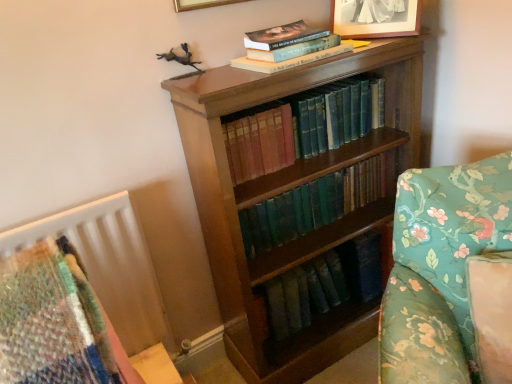
Image resolution: width=512 pixels, height=384 pixels. In order to click on floral fabric sofa at right in this screenshot , I will do `click(450, 277)`.

Describe the element at coordinates (289, 60) in the screenshot. I see `hardcover book at upper center, which is the first book in top-to-bottom order` at that location.

What do you see at coordinates (287, 190) in the screenshot? The width and height of the screenshot is (512, 384). I see `wooden bookcase at center` at bounding box center [287, 190].

What do you see at coordinates (375, 18) in the screenshot?
I see `matte silver picture frame at upper center` at bounding box center [375, 18].

This screenshot has width=512, height=384. Identify the location of green leather book at center, which is the 2th book from top to bottom. (301, 126).

Find the location of a particular element. This screenshot has height=384, width=512. floral fabric sofa at right is located at coordinates (450, 277).

Can you confirm if wooden bookcase at center is smaller than hardcover book at upper center, positioned as the third book in bottom-to-top order?

No, wooden bookcase at center is not smaller than hardcover book at upper center, positioned as the third book in bottom-to-top order.

Does wooden bookcase at center touch hardcover book at upper center, which is the first book in top-to-bottom order?

There is a gap between wooden bookcase at center and hardcover book at upper center, which is the first book in top-to-bottom order.

Which of these two, wooden bookcase at center or hardcover book at upper center, which is the first book in top-to-bottom order, is thinner?

With smaller width is hardcover book at upper center, which is the first book in top-to-bottom order.

From the picture: Which is closer, (377, 34) or (291, 59)?

Point (377, 34).

Find the location of `the 1st book below the matte silver picture frame at upper center (from a real-world perspective)`. the 1st book below the matte silver picture frame at upper center (from a real-world perspective) is located at coordinates coord(289,60).

Considering the relative sizes of matte silver picture frame at upper center and hardcover book at upper center, positioned as the third book in bottom-to-top order, in the image provided, is matte silver picture frame at upper center bigger than hardcover book at upper center, positioned as the third book in bottom-to-top order,?

Yes.

From a real-world perspective, between matte silver picture frame at upper center and hardcover book at upper center, which is the first book in top-to-bottom order, who is vertically lower?

From a 3D spatial view, hardcover book at upper center, which is the first book in top-to-bottom order, is below.

Does matte silver picture frame at upper center have a greater width compared to floral fabric sofa at right?

No, matte silver picture frame at upper center is not wider than floral fabric sofa at right.

Is matte silver picture frame at upper center turned away from floral fabric sofa at right?

No, matte silver picture frame at upper center is not facing away from floral fabric sofa at right.

Considering the points (349, 36) and (492, 317), which point is behind, point (349, 36) or point (492, 317)?

The point (349, 36) is more distant.

From a real-world perspective, is green leather book at center, arranged as the 1th book when ordered from the bottom, physically below hardcover book at upper center, positioned as the third book in bottom-to-top order?

Correct, in the physical world, green leather book at center, arranged as the 1th book when ordered from the bottom, is lower than hardcover book at upper center, positioned as the third book in bottom-to-top order.

Considering the positions of objects green leather book at center, arranged as the 3th book when viewed from the top, and hardcover book at upper center, positioned as the third book in bottom-to-top order, in the image provided, who is behind, green leather book at center, arranged as the 3th book when viewed from the top, or hardcover book at upper center, positioned as the third book in bottom-to-top order,?

Positioned behind is green leather book at center, arranged as the 3th book when viewed from the top.

Is green leather book at center, arranged as the 1th book when ordered from the bottom, facing towards hardcover book at upper center, positioned as the third book in bottom-to-top order?

No, green leather book at center, arranged as the 1th book when ordered from the bottom, is not oriented towards hardcover book at upper center, positioned as the third book in bottom-to-top order.

Would you say green leather book at center, arranged as the 1th book when ordered from the bottom, contains hardcover book at upper center, positioned as the third book in bottom-to-top order?

Definitely not — hardcover book at upper center, positioned as the third book in bottom-to-top order, is not inside green leather book at center, arranged as the 1th book when ordered from the bottom.

Between hardcover book at upper center, which is the first book in top-to-bottom order, and wooden bookcase at center, which one appears on the right side from the viewer's perspective?

Positioned to the right is wooden bookcase at center.

In terms of size, does hardcover book at upper center, positioned as the third book in bottom-to-top order, appear bigger or smaller than wooden bookcase at center?

In the image, hardcover book at upper center, positioned as the third book in bottom-to-top order, appears to be smaller than wooden bookcase at center.

Is hardcover book at upper center, which is the first book in top-to-bottom order, beside wooden bookcase at center?

No, hardcover book at upper center, which is the first book in top-to-bottom order, is not with wooden bookcase at center.

Is green leather book at center, arranged as the 3th book when viewed from the top, wider than green leather book at center, placed as the second book when sorted from bottom to top?

Indeed, green leather book at center, arranged as the 3th book when viewed from the top, has a greater width compared to green leather book at center, placed as the second book when sorted from bottom to top.

Is green leather book at center, arranged as the 1th book when ordered from the bottom, oriented towards green leather book at center, which is the 2th book from top to bottom?

No, green leather book at center, arranged as the 1th book when ordered from the bottom, is not turned towards green leather book at center, which is the 2th book from top to bottom.

Which of these two, green leather book at center, arranged as the 3th book when viewed from the top, or green leather book at center, placed as the second book when sorted from bottom to top, stands shorter?

Standing shorter between the two is green leather book at center, arranged as the 3th book when viewed from the top.

Is green leather book at center, arranged as the 3th book when viewed from the top, at the left side of floral fabric sofa at right?

Yes.

From the image's perspective, which object appears higher, green leather book at center, arranged as the 1th book when ordered from the bottom, or floral fabric sofa at right?

green leather book at center, arranged as the 1th book when ordered from the bottom.

Is green leather book at center, arranged as the 1th book when ordered from the bottom, inside the boundaries of floral fabric sofa at right, or outside?

green leather book at center, arranged as the 1th book when ordered from the bottom, is spatially situated outside floral fabric sofa at right.

Is the depth of green leather book at center, arranged as the 3th book when viewed from the top, less than that of floral fabric sofa at right?

No, the depth of green leather book at center, arranged as the 3th book when viewed from the top, is greater than that of floral fabric sofa at right.

Which book is the 1st one when counting from the back of the wooden bookcase at center? Please provide its 2D coordinates.

[(289, 60)]

Where is `picture frame lying on the right of hardcover book at upper center, positioned as the third book in bottom-to-top order`? This screenshot has height=384, width=512. picture frame lying on the right of hardcover book at upper center, positioned as the third book in bottom-to-top order is located at coordinates (375, 18).

Which object lies nearer to the anchor point floral fabric sofa at right, hardcover book at upper center, positioned as the third book in bottom-to-top order, or green leather book at center, which is the 2th book from top to bottom?

Based on the image, green leather book at center, which is the 2th book from top to bottom, appears to be nearer to floral fabric sofa at right.

Estimate the real-world distances between objects in this image. Which object is further from matte silver picture frame at upper center, green leather book at center, which is the 2th book from top to bottom, or wooden bookcase at center?

Among the two, wooden bookcase at center is located further to matte silver picture frame at upper center.

From the image, which object appears to be farther from wooden bookcase at center, green leather book at center, placed as the second book when sorted from bottom to top, or floral fabric sofa at right?

Based on the image, floral fabric sofa at right appears to be further to wooden bookcase at center.

Based on their spatial positions, is wooden bookcase at center or hardcover book at upper center, positioned as the third book in bottom-to-top order, further from floral fabric sofa at right?

Among the two, hardcover book at upper center, positioned as the third book in bottom-to-top order, is located further to floral fabric sofa at right.

When comparing their distances from green leather book at center, which is the 2th book from top to bottom, does wooden bookcase at center or hardcover book at upper center, positioned as the third book in bottom-to-top order, seem closer?

wooden bookcase at center is closer to green leather book at center, which is the 2th book from top to bottom.

Estimate the real-world distances between objects in this image. Which object is closer to green leather book at center, arranged as the 1th book when ordered from the bottom, hardcover book at upper center, which is the first book in top-to-bottom order, or floral fabric sofa at right?

floral fabric sofa at right lies closer to green leather book at center, arranged as the 1th book when ordered from the bottom, than the other object.

Looking at this image, estimate the real-world distances between objects in this image. Which object is closer to hardcover book at upper center, which is the first book in top-to-bottom order, matte silver picture frame at upper center or wooden bookcase at center?

Among the two, matte silver picture frame at upper center is located nearer to hardcover book at upper center, which is the first book in top-to-bottom order.

Considering their positions, is matte silver picture frame at upper center positioned further to floral fabric sofa at right than hardcover book at upper center, which is the first book in top-to-bottom order?

Among the two, matte silver picture frame at upper center is located further to floral fabric sofa at right.

This screenshot has height=384, width=512. Identify the location of bookcase between hardcover book at upper center, which is the first book in top-to-bottom order, and floral fabric sofa at right from top to bottom. (287, 190).

Find the location of `bookcase between floral fabric sofa at right and green leather book at center, arranged as the 3th book when viewed from the top, along the z-axis`. bookcase between floral fabric sofa at right and green leather book at center, arranged as the 3th book when viewed from the top, along the z-axis is located at coordinates (x=287, y=190).

Locate an element on the screen. Image resolution: width=512 pixels, height=384 pixels. book between hardcover book at upper center, positioned as the third book in bottom-to-top order, and green leather book at center, arranged as the 1th book when ordered from the bottom, vertically is located at coordinates (301, 126).

Locate an element on the screen. book between matte silver picture frame at upper center and green leather book at center, which is the 2th book from top to bottom, in the up-down direction is located at coordinates (289, 60).